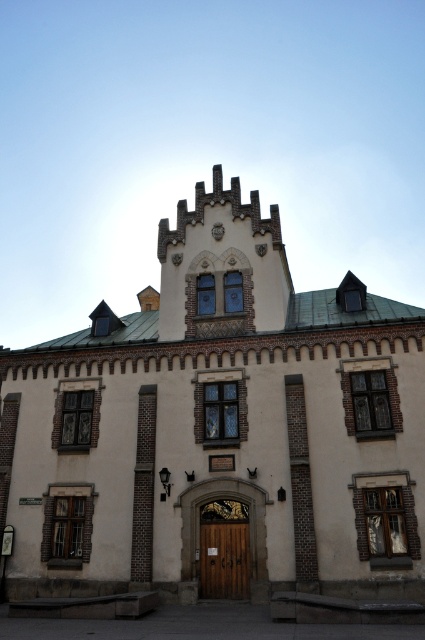
I want to click on beige stone church at center, so click(218, 426).

Describe the element at coordinates (218, 426) in the screenshot. I see `beige stone church at center` at that location.

Which is behind, point (40, 364) or point (221, 579)?

The point (40, 364) is behind.

Identify the location of beige stone church at center. (218, 426).